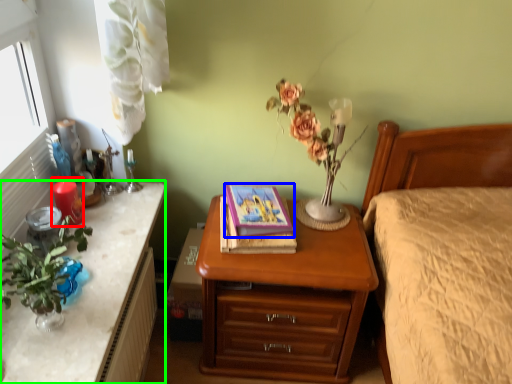
Question: Which object is the closest to the candle (highlighted by a red box)? Choose among these: book (highlighted by a blue box) or desk (highlighted by a green box).

Choices:
 (A) book
 (B) desk

Answer: (B)